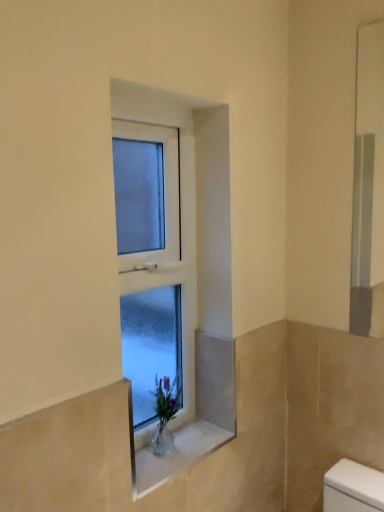
Question: Is clear glass vase at center shorter than white frosted glass window at center?

Choices:
 (A) yes
 (B) no

Answer: (A)

Question: Is clear glass vase at center facing away from white frosted glass window at center?

Choices:
 (A) yes
 (B) no

Answer: (B)

Question: Is clear glass vase at center with white frosted glass window at center?

Choices:
 (A) yes
 (B) no

Answer: (B)

Question: Does clear glass vase at center come behind white frosted glass window at center?

Choices:
 (A) no
 (B) yes

Answer: (B)

Question: From the image's perspective, is clear glass vase at center beneath white frosted glass window at center?

Choices:
 (A) no
 (B) yes

Answer: (B)

Question: Could white frosted glass window at center be considered to be inside clear glass vase at center?

Choices:
 (A) yes
 (B) no

Answer: (B)

Question: Does white frosted glass window at center appear on the left side of clear glass vase at center?

Choices:
 (A) no
 (B) yes

Answer: (B)

Question: Could you tell me if white frosted glass window at center is turned towards clear glass vase at center?

Choices:
 (A) no
 (B) yes

Answer: (B)

Question: Is clear glass vase at center at the back of white frosted glass window at center?

Choices:
 (A) no
 (B) yes

Answer: (A)

Question: Can you confirm if white frosted glass window at center is taller than clear glass vase at center?

Choices:
 (A) no
 (B) yes

Answer: (B)

Question: Can you confirm if white frosted glass window at center is bigger than clear glass vase at center?

Choices:
 (A) yes
 (B) no

Answer: (A)

Question: From a real-world perspective, is white frosted glass window at center on top of clear glass vase at center?

Choices:
 (A) yes
 (B) no

Answer: (A)

Question: From their relative heights in the image, would you say clear glass vase at center is taller or shorter than white frosted glass window at center?

Choices:
 (A) short
 (B) tall

Answer: (A)